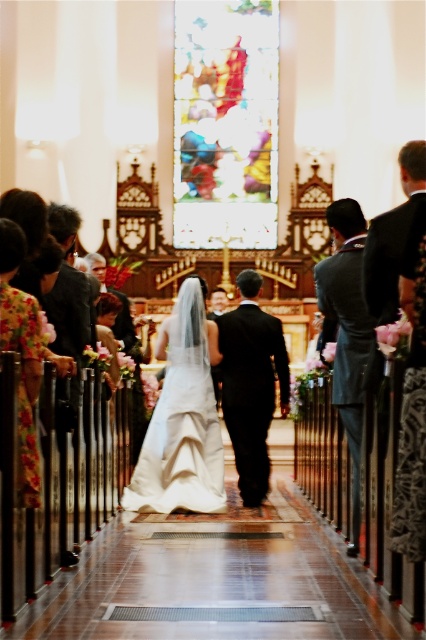
Is white satin dress at center bigger than dark gray suit at center?

Yes, white satin dress at center is bigger than dark gray suit at center.

Can you confirm if white satin dress at center is positioned below dark gray suit at center?

Correct, white satin dress at center is located below dark gray suit at center.

Between point (216, 433) and point (331, 332), which one is positioned in front?

Point (331, 332)

You are a GUI agent. You are given a task and a screenshot of the screen. Output one action in this format:
    pyautogui.click(x=<x>, y=<y>)
    Task: Click on the white satin dress at center
    Image resolution: width=426 pixels, height=640 pixels.
    Given the screenshot: What is the action you would take?
    pyautogui.click(x=183, y=417)

Locate an element on the screen. Image resolution: width=426 pixels, height=640 pixels. wooden floor at center is located at coordinates click(215, 580).

Consider the image. Is wooden floor at center to the left of dark gray suit at center from the viewer's perspective?

Correct, you'll find wooden floor at center to the left of dark gray suit at center.

Locate an element on the screen. The width and height of the screenshot is (426, 640). wooden floor at center is located at coordinates (215, 580).

Locate an element on the screen. white satin dress at center is located at coordinates (183, 417).

Describe the element at coordinates (183, 417) in the screenshot. I see `white satin dress at center` at that location.

Where is `white satin dress at center`? The width and height of the screenshot is (426, 640). white satin dress at center is located at coordinates (183, 417).